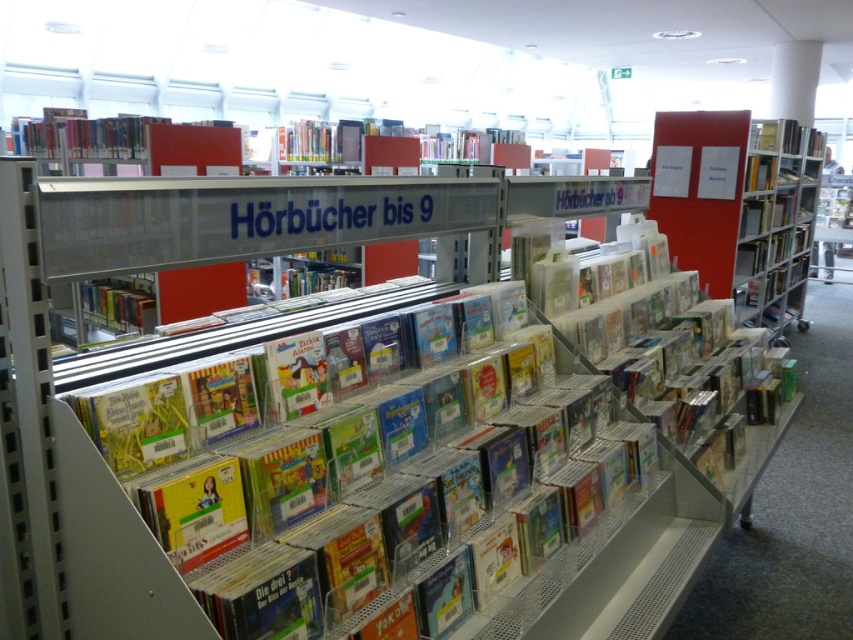
Is metallic silver bookshelf at right taller than matte plastic book at center?

Correct, metallic silver bookshelf at right is much taller as matte plastic book at center.

Is metallic silver bookshelf at right to the right of matte plastic book at center from the viewer's perspective?

Correct, you'll find metallic silver bookshelf at right to the right of matte plastic book at center.

Between point (756, 164) and point (149, 595), which one is positioned in front?

Positioned in front is point (149, 595).

What are the coordinates of `metallic silver bookshelf at right` in the screenshot? It's located at (776, 224).

Does point (744, 211) come farther from viewer compared to point (122, 326)?

Yes, it is.

Who is lower down, metallic silver bookshelf at right or matte plastic book at left?

Positioned lower is matte plastic book at left.

You are a GUI agent. You are given a task and a screenshot of the screen. Output one action in this format:
    pyautogui.click(x=<x>, y=<y>)
    Task: Click on the metallic silver bookshelf at right
    The width and height of the screenshot is (853, 640).
    Given the screenshot: What is the action you would take?
    pyautogui.click(x=776, y=224)

I want to click on metallic silver bookshelf at right, so click(x=776, y=224).

You are a GUI agent. You are given a task and a screenshot of the screen. Output one action in this format:
    pyautogui.click(x=<x>, y=<y>)
    Task: Click on the matte plastic book at left
    This screenshot has width=853, height=640.
    Given the screenshot: What is the action you would take?
    pyautogui.click(x=119, y=305)

Does point (149, 285) come behind point (759, 125)?

No, it is in front of (759, 125).

This screenshot has width=853, height=640. Find the location of `matte plastic book at left`. matte plastic book at left is located at coordinates (x=119, y=305).